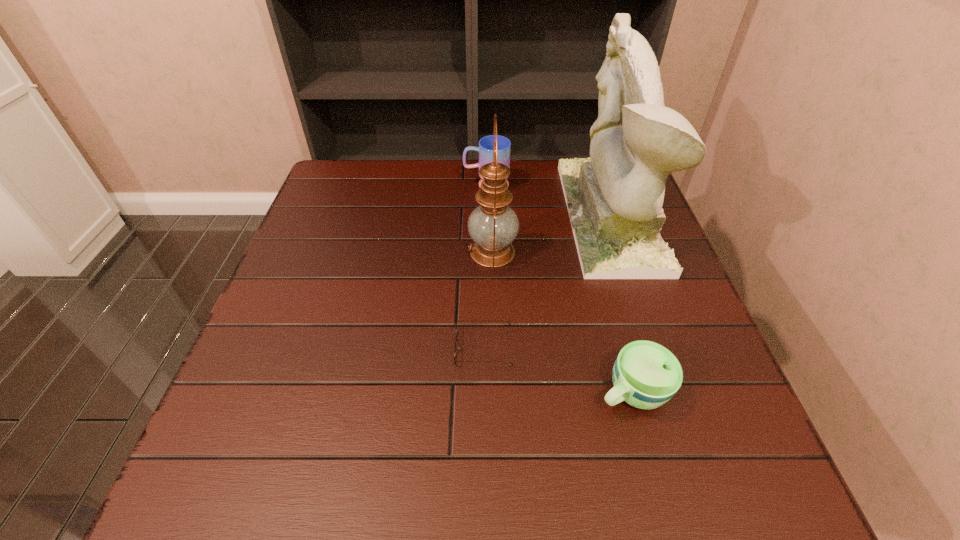
Locate an element on the screen. The height and width of the screenshot is (540, 960). the tallest object is located at coordinates pos(614,199).

The width and height of the screenshot is (960, 540). I want to click on oil lamp, so click(493, 226).

The width and height of the screenshot is (960, 540). I want to click on mug, so click(485, 149).

Where is `cup`? cup is located at coordinates (646, 375).

Image resolution: width=960 pixels, height=540 pixels. I want to click on the shortest object, so click(456, 338).

Find the location of a particular element. Image resolution: width=960 pixels, height=540 pixels. free space located 0.050m on the base of the tallest object is located at coordinates (551, 215).

This screenshot has height=540, width=960. What are the coordinates of `free location located 0.070m on the base of the tallest object` in the screenshot? It's located at [x=543, y=215].

Where is `free space located on the base of the tallest object`? free space located on the base of the tallest object is located at coordinates click(551, 215).

This screenshot has height=540, width=960. I want to click on free spot located 0.360m on the left of the fourth shortest object, so click(x=323, y=252).

Identify the location of free spot located on the side of the third tallest object with the handle. pos(430,185).